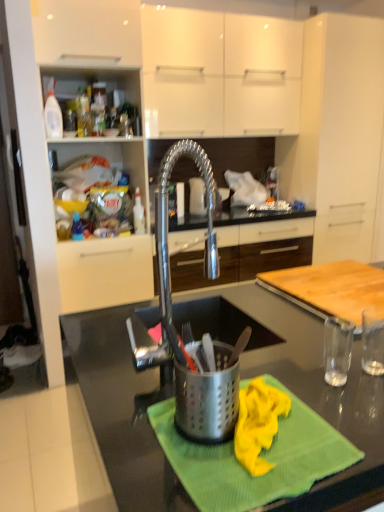
Where is `free space to the left of green textured cloth at center`? free space to the left of green textured cloth at center is located at coordinates (123, 421).